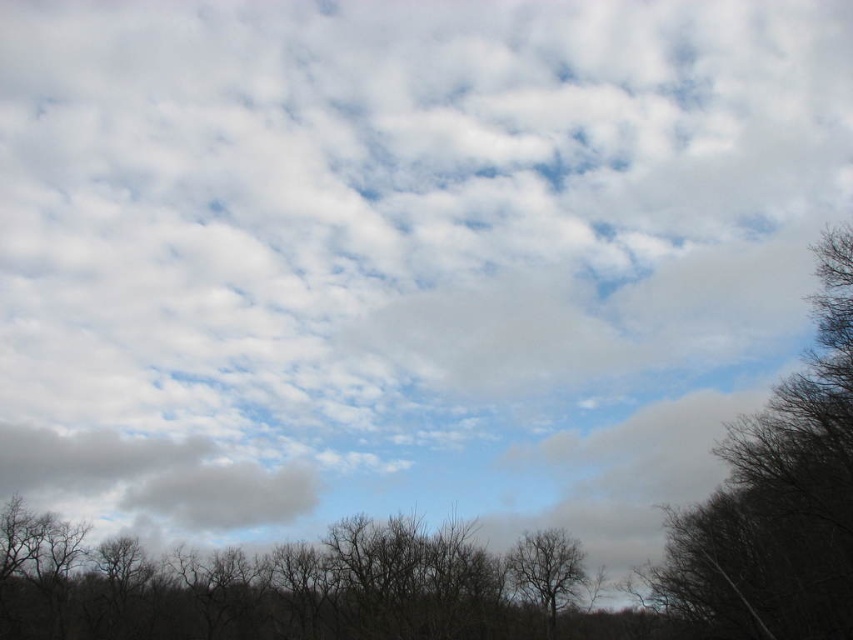
Based on the photo, you are a bird flying in the sky. You see the bare branches at right and the gray fluffy cloud at lower left. Which one is located above the other?

The bare branches at right is positioned over the gray fluffy cloud at lower left, so the bare branches at right is above the gray fluffy cloud at lower left.

You are standing in the forest looking up at the sky. You notice a specific point marked at coordinates point (778,499). Based on the scene description, what do you see at that point?

The point (778,499) indicates bare branches at right.